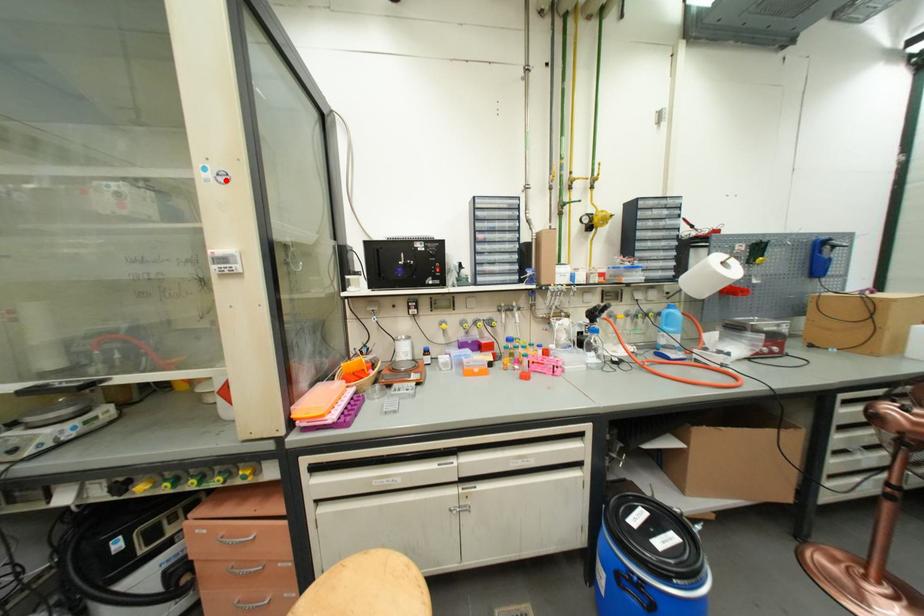
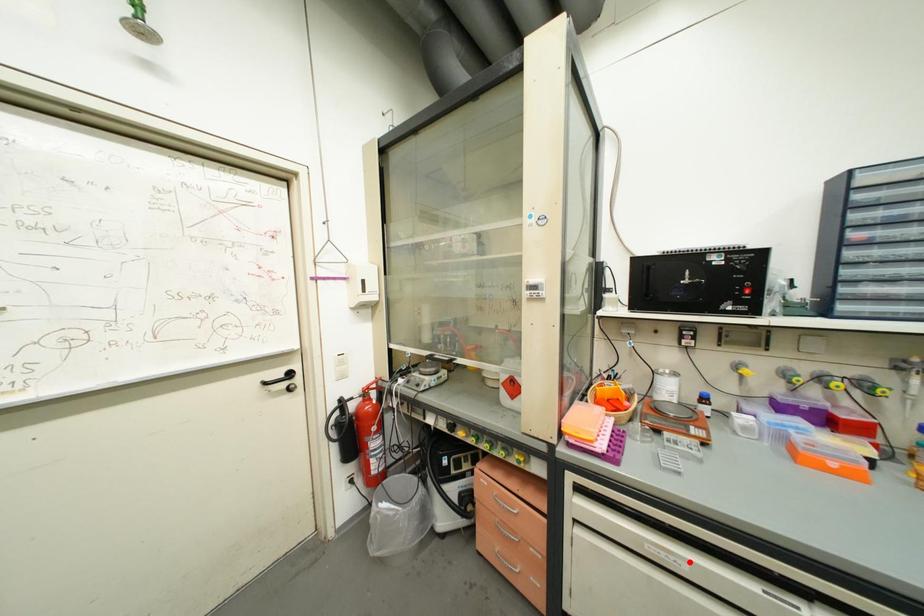
I am providing you with two images of the same scene from different viewpoints. A red point is marked on the first image and another point is marked on the second image. Is the red point in image1 aligned with the point shown in image2?

No